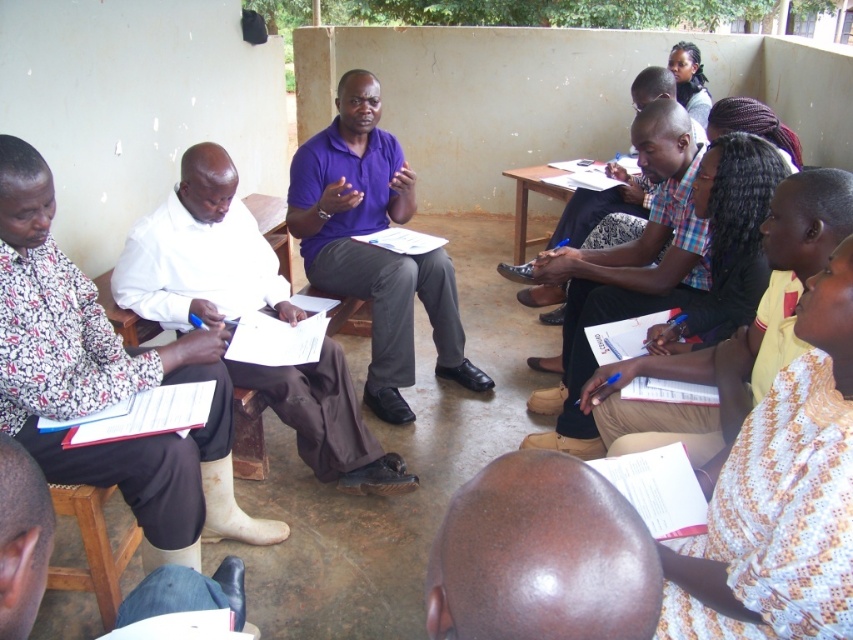
Question: From the image, what is the correct spatial relationship of white paper at center in relation to purple matte shirt at center?

Choices:
 (A) below
 (B) above

Answer: (A)

Question: Which of the following is the farthest from the observer?

Choices:
 (A) light brown fabric at center
 (B) purple matte shirt at center
 (C) shiny brown head at center

Answer: (B)

Question: Which of these objects is positioned farthest from the purple matte shirt at center?

Choices:
 (A) white printed dress at lower right
 (B) white paper at center
 (C) light brown fabric at center
 (D) white matte shirt at left

Answer: (A)

Question: Which point is farther from the camera taking this photo?

Choices:
 (A) (426, 296)
 (B) (514, 502)
 (C) (132, 378)

Answer: (A)

Question: Can you confirm if white matte shirt at left is wider than white printed dress at lower right?

Choices:
 (A) yes
 (B) no

Answer: (A)

Question: Where is white matte shirt at left located in relation to purple matte shirt at center in the image?

Choices:
 (A) right
 (B) left

Answer: (B)